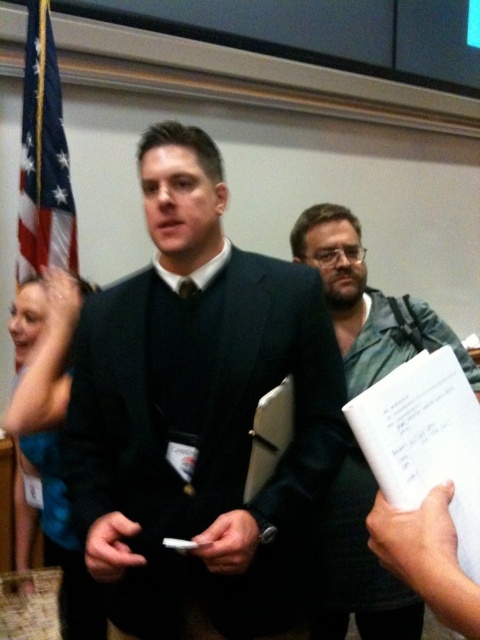
Question: Among these objects, which one is farthest from the camera?

Choices:
 (A) dark blue suit at center
 (B) green textured shirt at center

Answer: (B)

Question: Which point is farther to the camera?

Choices:
 (A) (475, 392)
 (B) (224, 378)

Answer: (B)

Question: Is dark blue suit at center to the left of green textured shirt at center from the viewer's perspective?

Choices:
 (A) yes
 (B) no

Answer: (A)

Question: Is dark blue suit at center closer to the viewer compared to green textured shirt at center?

Choices:
 (A) yes
 (B) no

Answer: (A)

Question: Does dark blue suit at center appear on the right side of green textured shirt at center?

Choices:
 (A) no
 (B) yes

Answer: (A)